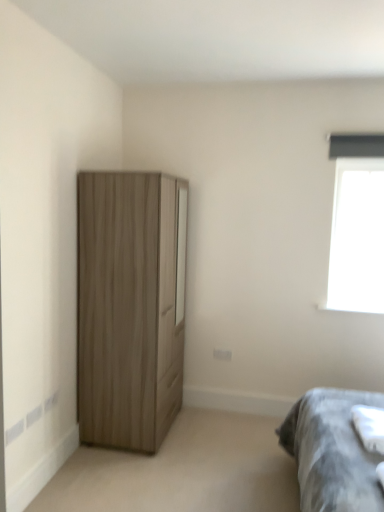
Question: Looking at the image, does wooden wardrobe at left seem bigger or smaller compared to gray fabric bedsheet at lower right?

Choices:
 (A) big
 (B) small

Answer: (A)

Question: From the image's perspective, relative to gray fabric bedsheet at lower right, is wooden wardrobe at left above or below?

Choices:
 (A) above
 (B) below

Answer: (A)

Question: Estimate the real-world distances between objects in this image. Which object is closer to the gray fabric bedsheet at lower right?

Choices:
 (A) wooden wardrobe at left
 (B) transparent glass window at upper right

Answer: (B)

Question: Estimate the real-world distances between objects in this image. Which object is farther from the wooden wardrobe at left?

Choices:
 (A) transparent glass window at upper right
 (B) gray fabric bedsheet at lower right

Answer: (A)